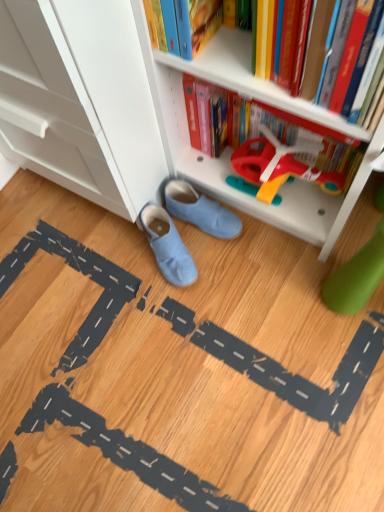
Where is `empty space that is to the right of suede-like blue slippers at center, the first footwear when ordered from top to bottom`? This screenshot has height=512, width=384. empty space that is to the right of suede-like blue slippers at center, the first footwear when ordered from top to bottom is located at coordinates point(273,237).